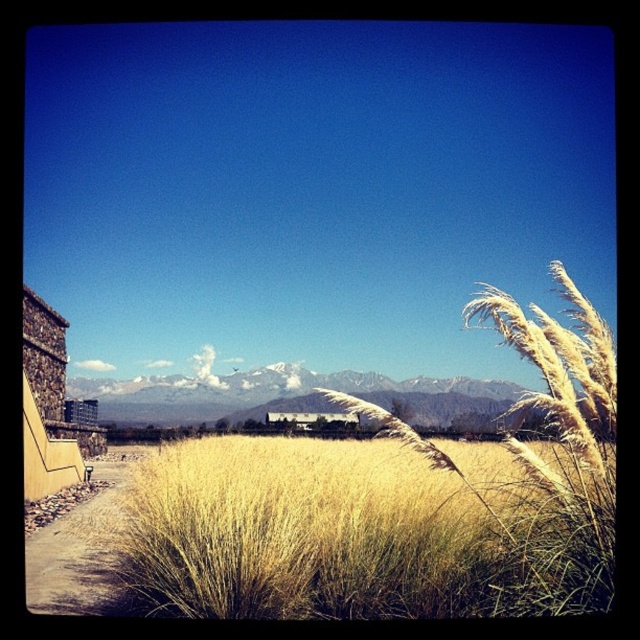
You are a hiker planning to cross the area shown in the image. You need to choose between walking through the yellow grass at center or along the brown gravel path at lower left. Based on the space they occupy, which path would allow you to walk more comfortably and why?

The brown gravel path at lower left occupies more space than the yellow grass at center, so walking along the brown gravel path at lower left would be more comfortable due to its wider area.

You are a hiker trying to navigate through the yellow grass at center and the brown gravel path at lower left. Which path should you choose if you want to walk where the ground is higher?

The brown gravel path at lower left is higher than the yellow grass at center, so you should choose the brown gravel path at lower left for a higher ground.